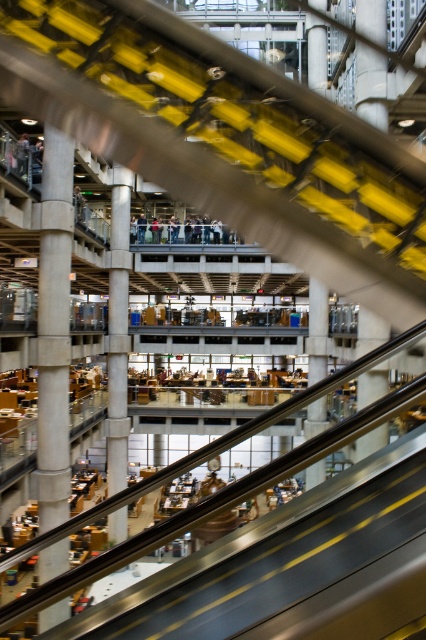
Question: Is concrete pillar at center thinner than concrete at center?

Choices:
 (A) yes
 (B) no

Answer: (B)

Question: Among these objects, which one is farthest from the camera?

Choices:
 (A) concrete pillar at center
 (B) smooth gray pillar at center

Answer: (B)

Question: Is concrete pillar at center bigger than concrete at center?

Choices:
 (A) yes
 (B) no

Answer: (A)

Question: Can you confirm if dark blue jeans at center is wider than matte black jacket at upper center?

Choices:
 (A) no
 (B) yes

Answer: (B)

Question: Which of the following is the farthest from the observer?

Choices:
 (A) (106, 436)
 (B) (13, 157)
 (C) (143, 216)
 (D) (40, 342)

Answer: (C)

Question: Which of the following is the closest to the observer?

Choices:
 (A) (316, 432)
 (B) (63, 211)
 (C) (14, 147)

Answer: (C)